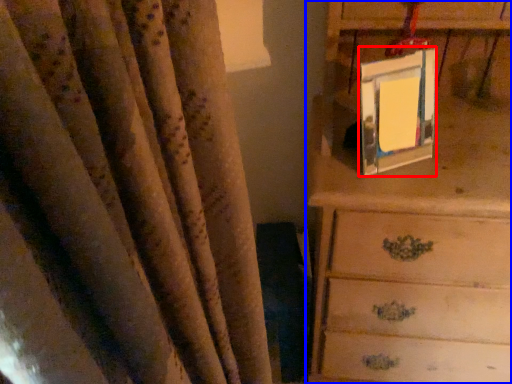
Question: Which point is further to the camera, picture frame (highlighted by a red box) or chest of drawers (highlighted by a blue box)?

Choices:
 (A) picture frame
 (B) chest of drawers

Answer: (A)